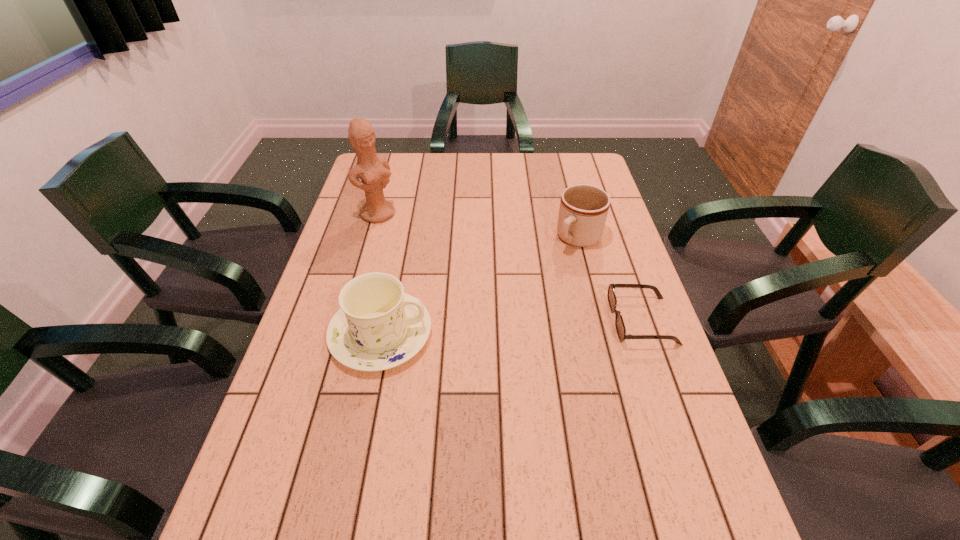
This screenshot has width=960, height=540. Find the location of `vacant space on the desktop that is between the chinaware and the sunglasses and is positioned on the side of the mug with the handle`. vacant space on the desktop that is between the chinaware and the sunglasses and is positioned on the side of the mug with the handle is located at coordinates (x=490, y=328).

Identify the location of free spot on the desktop that is between the chinaware and the sunglasses and is positioned on the front-facing side of the tallest object. The width and height of the screenshot is (960, 540). (493, 328).